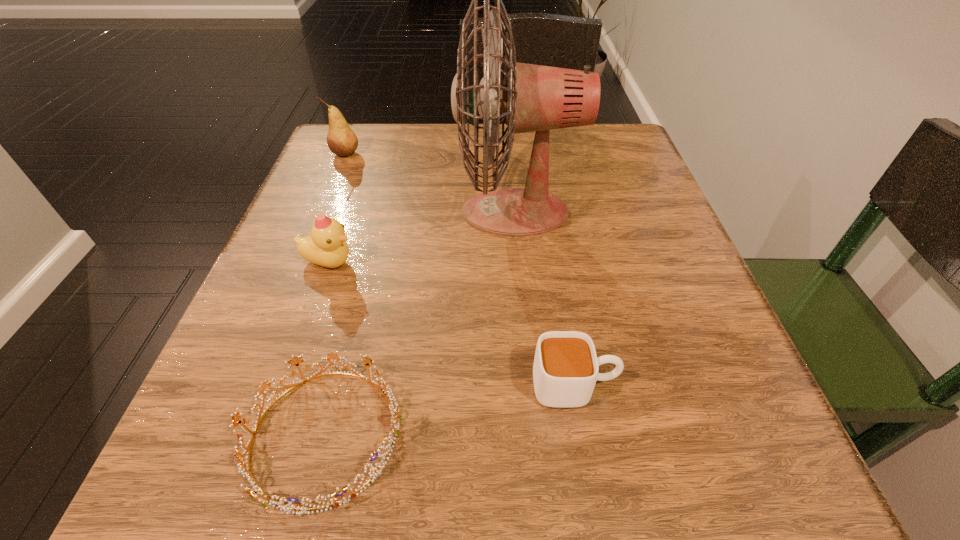
Locate an element on the screen. The image size is (960, 540). free space that is in between the fan and the pear is located at coordinates (430, 183).

The image size is (960, 540). I want to click on vacant space that is in between the cup and the shortest object, so click(449, 410).

At what (x,y) coordinates should I click in order to perform the action: click on vacant area that lies between the tallest object and the shortest object. Please return your answer as a coordinate pair (x, y). The width and height of the screenshot is (960, 540). Looking at the image, I should click on (420, 323).

In order to click on free space between the third tallest object and the shortest object in this screenshot , I will do `click(327, 349)`.

At what (x,y) coordinates should I click in order to perform the action: click on empty space between the tiara and the tallest object. Please return your answer as a coordinate pair (x, y). This screenshot has height=540, width=960. Looking at the image, I should click on (420, 323).

This screenshot has width=960, height=540. In order to click on vacant area between the cup and the shortest object in this screenshot , I will do `click(449, 410)`.

Identify the location of vacant space in between the second tallest object and the fan. Image resolution: width=960 pixels, height=540 pixels. (x=430, y=183).

Locate which object ranks second in proximity to the third tallest object. Please provide its 2D coordinates. Your answer should be formatted as a tuple, i.e. [(x, y)], where the tuple contains the x and y coordinates of a point satisfying the conditions above.

[(395, 415)]

Select which object appears as the fourth closest to the tallest object. Please provide its 2D coordinates. Your answer should be formatted as a tuple, i.e. [(x, y)], where the tuple contains the x and y coordinates of a point satisfying the conditions above.

[(341, 140)]